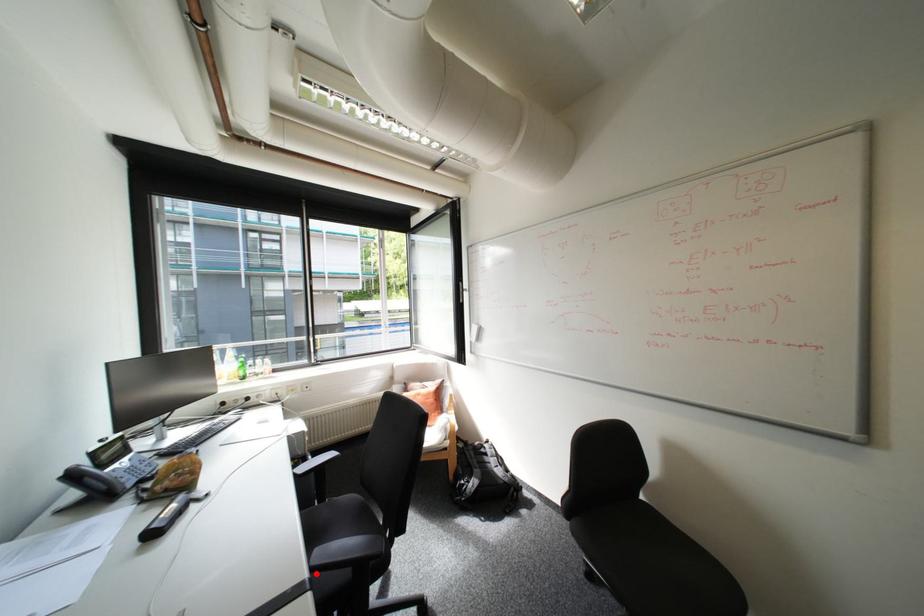
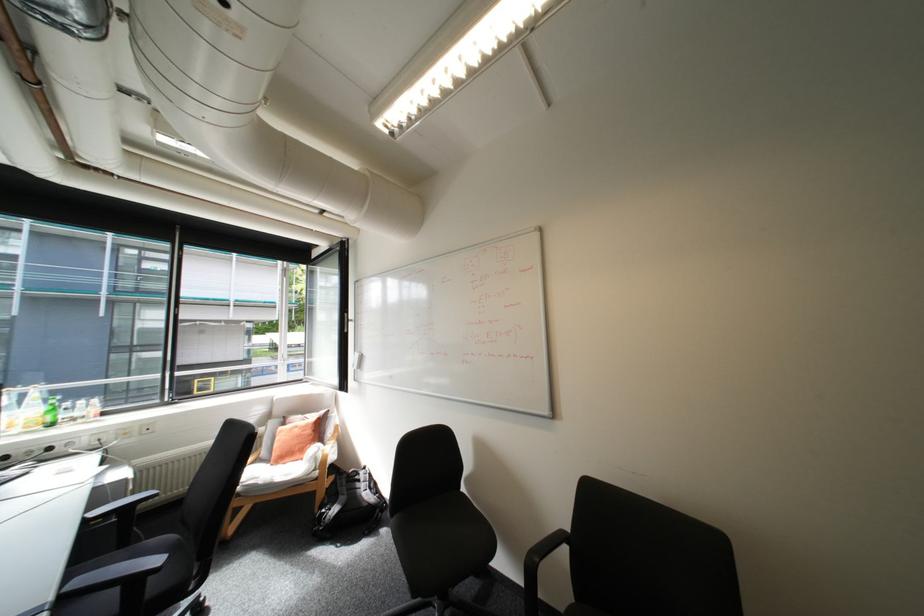
The point at the highlighted location is marked in the first image. Where is the corresponding point in the second image?

(61, 598)